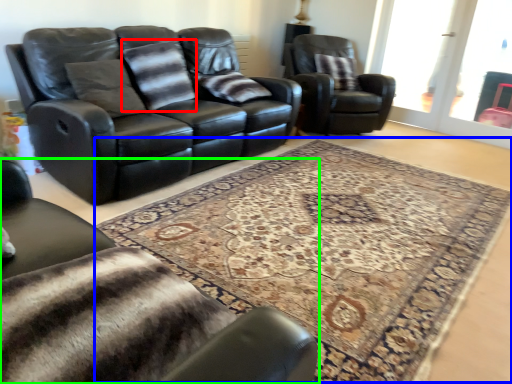
Question: Estimate the real-world distances between objects in this image. Which object is closer to pillow (highlighted by a red box), mat (highlighted by a blue box) or chair (highlighted by a green box)?

Choices:
 (A) mat
 (B) chair

Answer: (A)